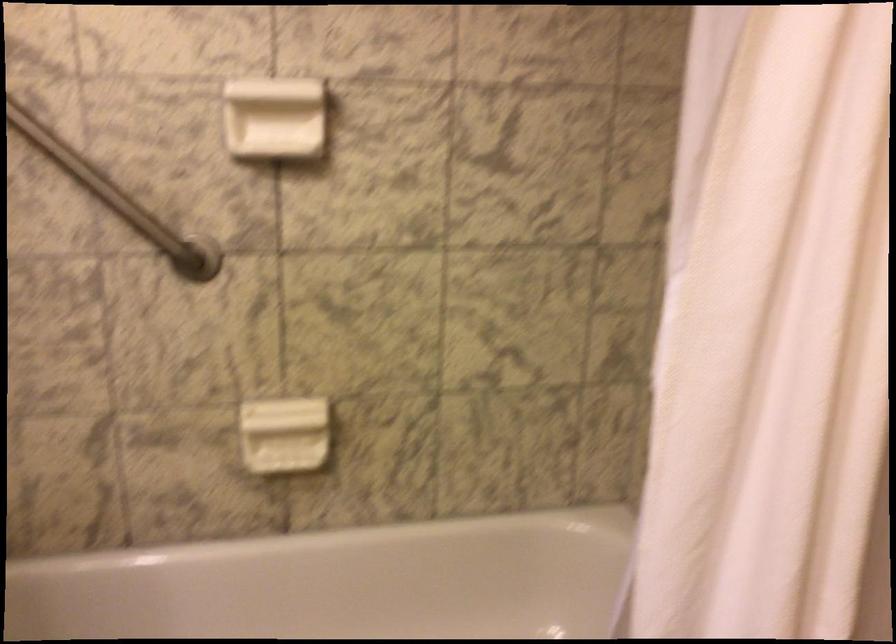
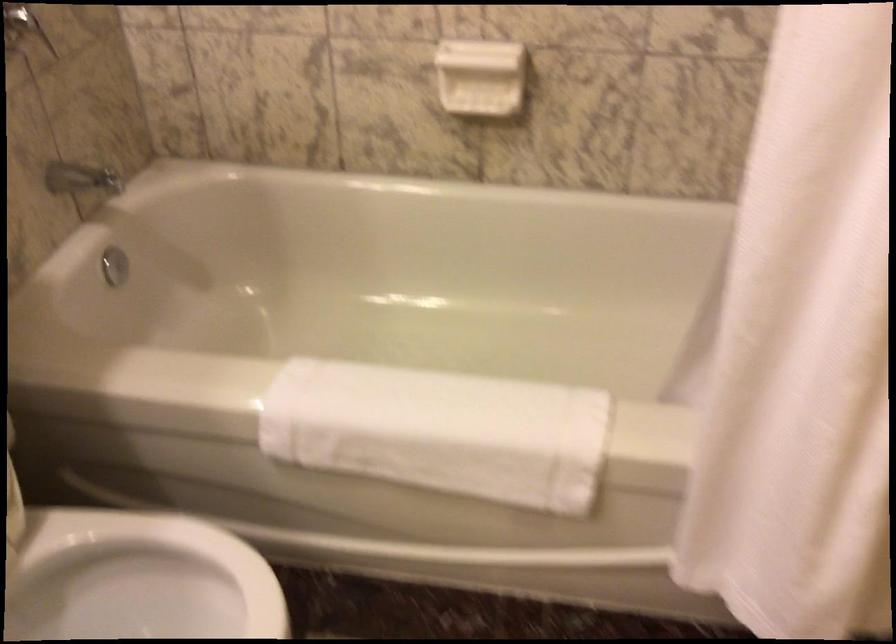
Locate, in the second image, the point that corresponds to point 288,428 in the first image.

(480, 77)